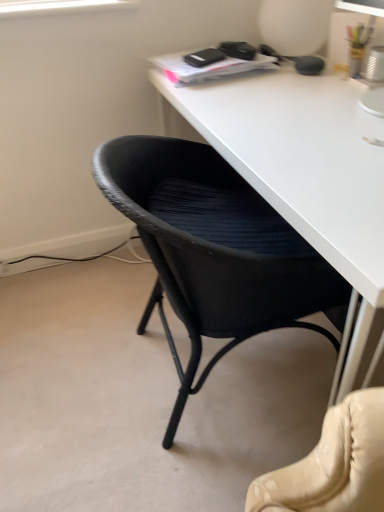
Where is `free region on the left part of black woven chair at center`? This screenshot has height=512, width=384. free region on the left part of black woven chair at center is located at coordinates (63, 360).